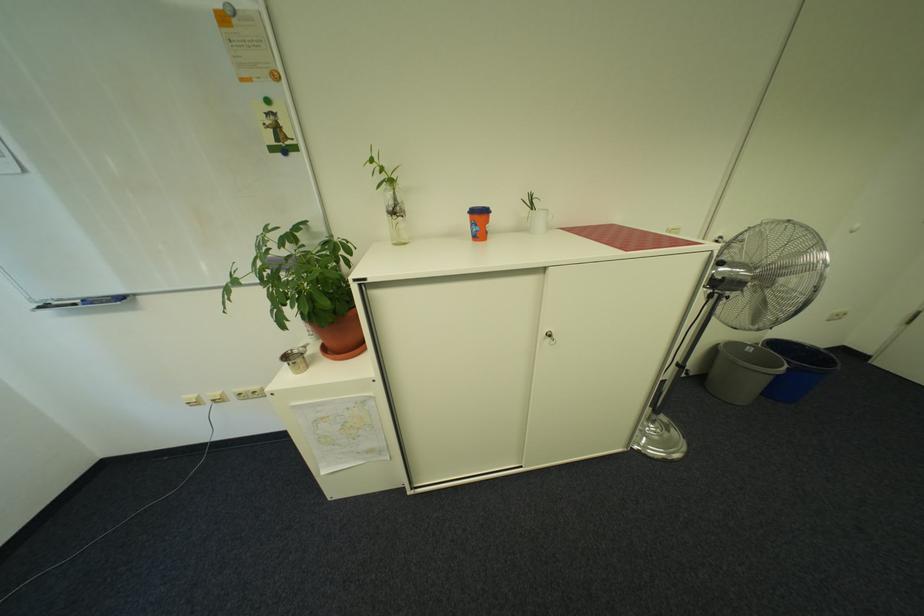
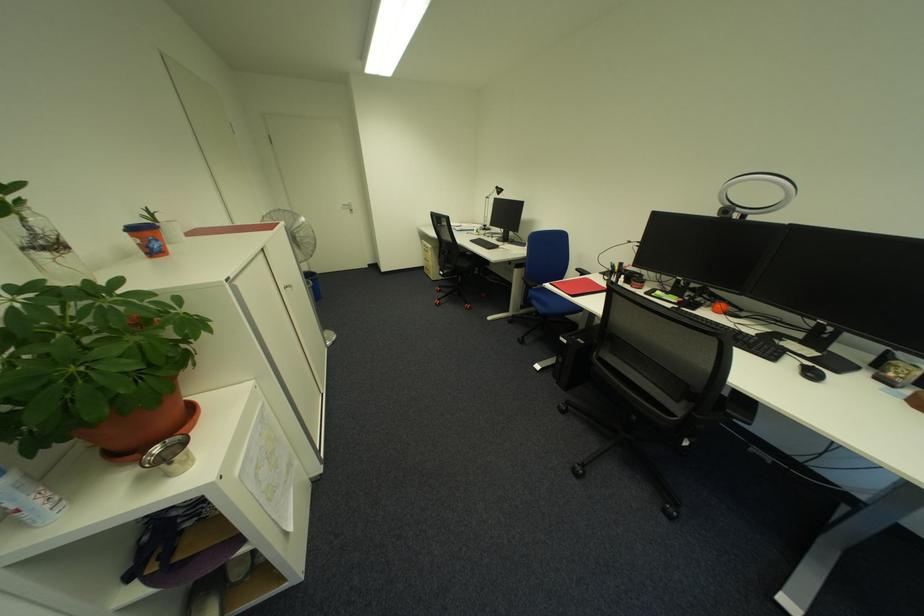
Where in the second image is the point corresponding to [406,200] from the first image?

(40, 230)